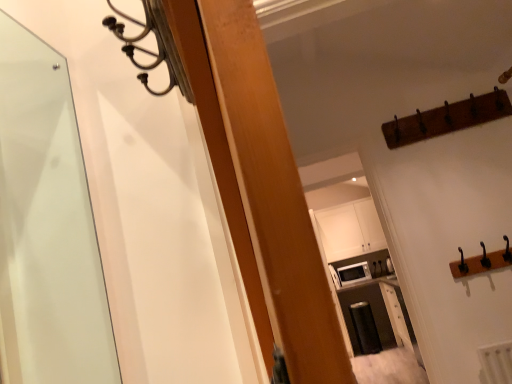
Question: Is white matte cabinet at upper center directly adjacent to white glossy microwave at upper center?

Choices:
 (A) no
 (B) yes

Answer: (A)

Question: Can you confirm if white matte cabinet at upper center is taller than white glossy microwave at upper center?

Choices:
 (A) no
 (B) yes

Answer: (B)

Question: Is white matte cabinet at upper center not close to white glossy microwave at upper center?

Choices:
 (A) no
 (B) yes

Answer: (A)

Question: From a real-world perspective, is white matte cabinet at upper center physically above white glossy microwave at upper center?

Choices:
 (A) no
 (B) yes

Answer: (B)

Question: Does white matte cabinet at upper center appear on the right side of white glossy microwave at upper center?

Choices:
 (A) yes
 (B) no

Answer: (B)

Question: Is white matte cabinet at upper center wider than white glossy microwave at upper center?

Choices:
 (A) yes
 (B) no

Answer: (B)

Question: Is white matte cabinet at upper center located within white glossy microwave at upper center?

Choices:
 (A) yes
 (B) no

Answer: (B)

Question: Could you tell me if white glossy microwave at upper center is turned towards white matte cabinet at upper center?

Choices:
 (A) yes
 (B) no

Answer: (B)

Question: From a real-world perspective, is white glossy microwave at upper center under white matte cabinet at upper center?

Choices:
 (A) no
 (B) yes

Answer: (B)

Question: Is white glossy microwave at upper center at the right side of white matte cabinet at upper center?

Choices:
 (A) yes
 (B) no

Answer: (A)

Question: Does white glossy microwave at upper center come behind white matte cabinet at upper center?

Choices:
 (A) yes
 (B) no

Answer: (B)

Question: Would you say white glossy microwave at upper center is outside white matte cabinet at upper center?

Choices:
 (A) yes
 (B) no

Answer: (A)

Question: Is white glossy microwave at upper center wider or thinner than white matte cabinet at upper center?

Choices:
 (A) thin
 (B) wide

Answer: (B)